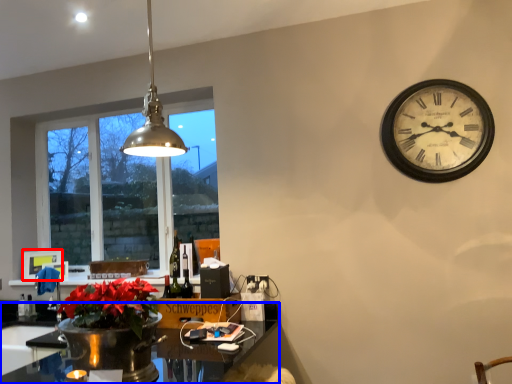
Question: Among these objects, which one is nearest to the camera, picture frame (highlighted by a red box) or desk (highlighted by a blue box)?

Choices:
 (A) picture frame
 (B) desk

Answer: (B)